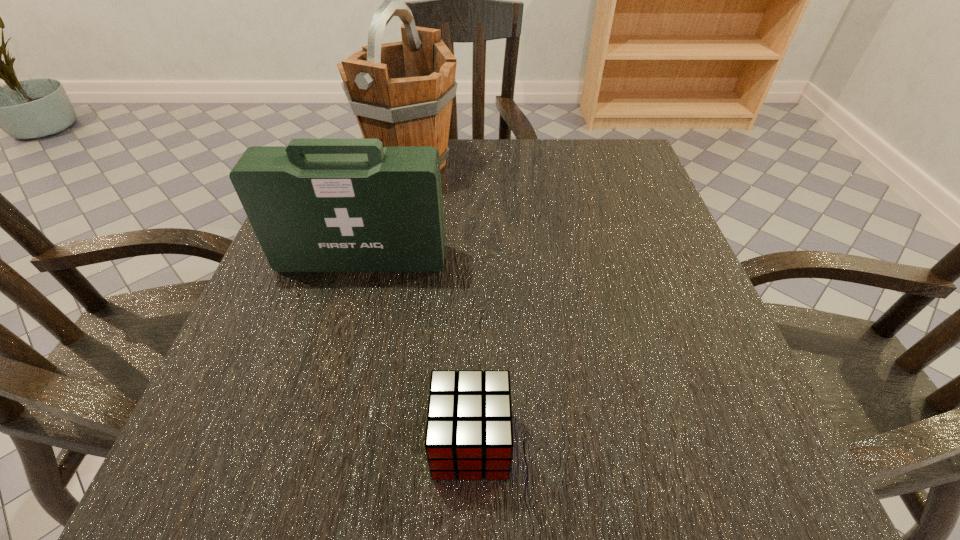
Find the location of `vacant region that satisfies the following two spatial constraints: 1. on the front side of the cube; 2. on the right side of the bucket`. vacant region that satisfies the following two spatial constraints: 1. on the front side of the cube; 2. on the right side of the bucket is located at coordinates click(x=352, y=442).

The height and width of the screenshot is (540, 960). Identify the location of vacant area that satisfies the following two spatial constraints: 1. on the front-facing side of the nearest object; 2. on the left side of the first-aid kit. (313, 442).

Where is `vacant space that satisfies the following two spatial constraints: 1. on the front side of the shortest object; 2. on the right side of the tallest object`? This screenshot has height=540, width=960. vacant space that satisfies the following two spatial constraints: 1. on the front side of the shortest object; 2. on the right side of the tallest object is located at coordinates (352, 442).

Image resolution: width=960 pixels, height=540 pixels. In order to click on free spot that satisfies the following two spatial constraints: 1. on the front-facing side of the second farthest object; 2. on the left side of the shortest object in this screenshot , I will do `click(313, 442)`.

What are the coordinates of `free point that satisfies the following two spatial constraints: 1. on the front side of the tallest object; 2. on the left side of the cube` in the screenshot? It's located at click(x=352, y=442).